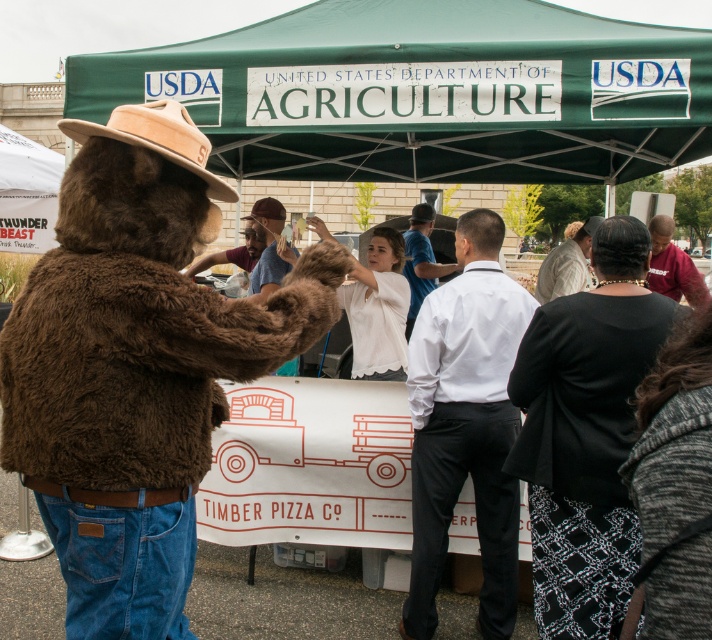
Question: Is green fabric canopy at upper center below brown fur hat at center?

Choices:
 (A) yes
 (B) no

Answer: (B)

Question: Based on their relative distances, which object is nearer to the white smooth shirt at center?

Choices:
 (A) fuzzy brown bear at left
 (B) maroon jersey at right

Answer: (A)

Question: Observing the image, what is the correct spatial positioning of maroon jersey at right in reference to blue cotton shirt at center?

Choices:
 (A) above
 (B) below

Answer: (B)

Question: Does brown felt cowboy hat at upper left lie behind white fur coat at center?

Choices:
 (A) no
 (B) yes

Answer: (A)

Question: Considering the real-world distances, which object is farthest from the maroon jersey at right?

Choices:
 (A) black textured jacket at lower right
 (B) brown fur hat at center
 (C) white fur coat at center
 (D) brown felt cowboy hat at upper left

Answer: (D)

Question: Which point is farther to the camera?

Choices:
 (A) (701, 282)
 (B) (639, 49)
 (C) (206, 148)
 (D) (555, 460)

Answer: (A)